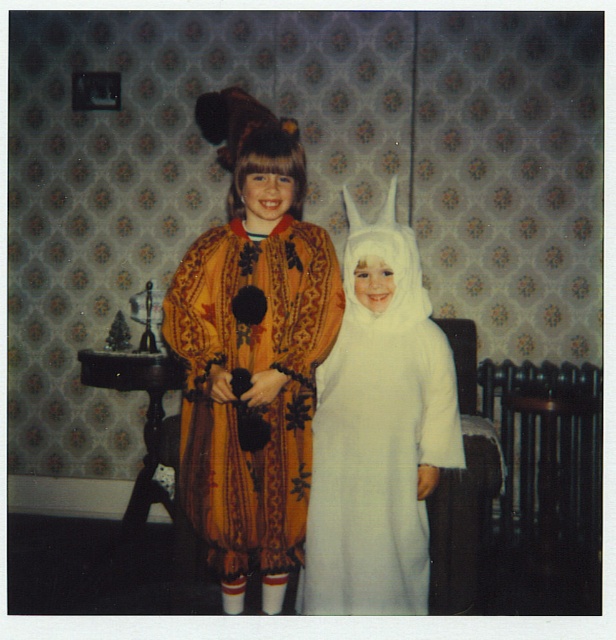
Question: Which is nearer to the white fluffy costume at center?

Choices:
 (A) golden velvet robe at center
 (B) velvet orange robe at center

Answer: (B)

Question: Among these points, which one is farthest from the camera?

Choices:
 (A) (283, 468)
 (B) (413, 509)
 (C) (296, 252)

Answer: (C)

Question: Among these objects, which one is nearest to the camera?

Choices:
 (A) golden velvet robe at center
 (B) velvet orange robe at center
 (C) white fluffy costume at center

Answer: (B)

Question: Does velvet orange robe at center have a greater width compared to white fluffy costume at center?

Choices:
 (A) no
 (B) yes

Answer: (B)

Question: Does velvet orange robe at center appear under golden velvet robe at center?

Choices:
 (A) no
 (B) yes

Answer: (A)

Question: Can you confirm if velvet orange robe at center is positioned to the right of golden velvet robe at center?

Choices:
 (A) no
 (B) yes

Answer: (B)